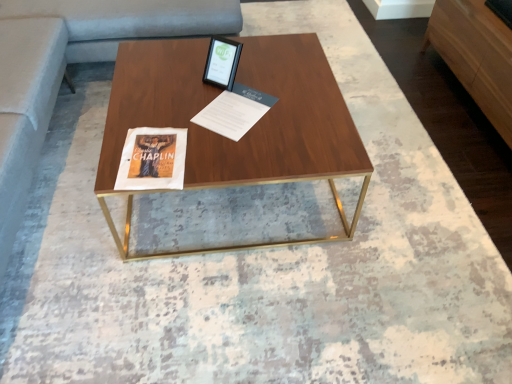
I want to click on unoccupied region to the right of matte black tablet at upper center, so click(x=261, y=79).